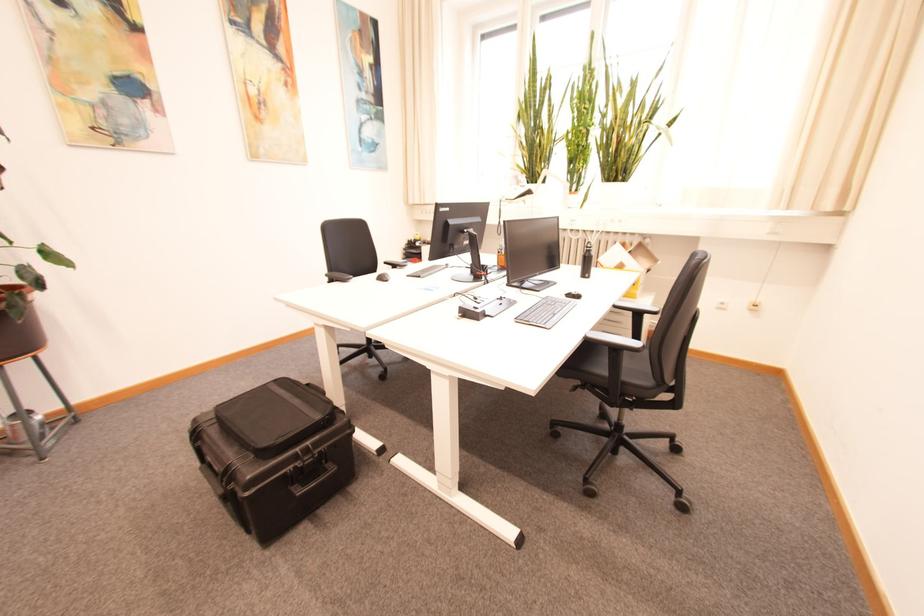
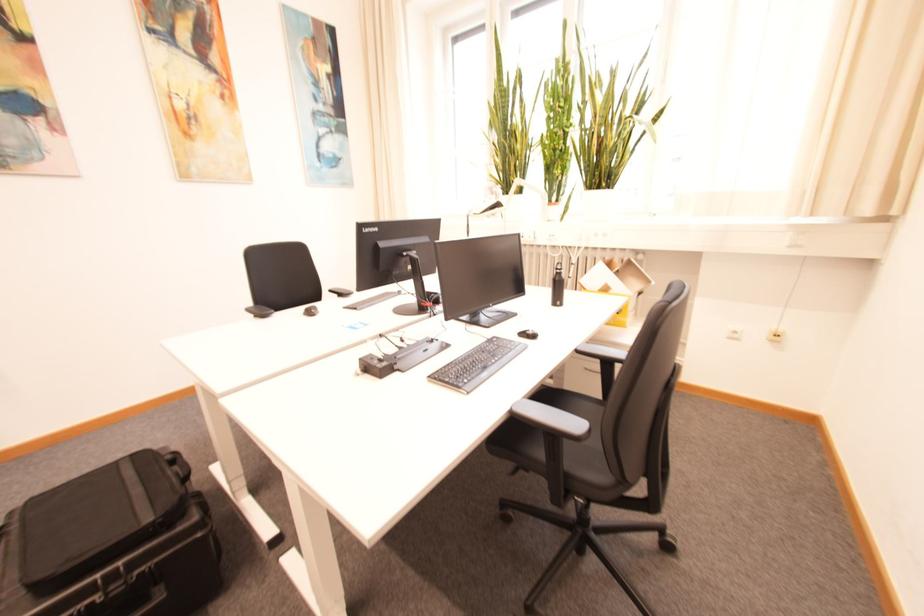
The images are taken continuously from a first-person perspective. In which direction are you moving?

The cameraman walked toward right, forward.